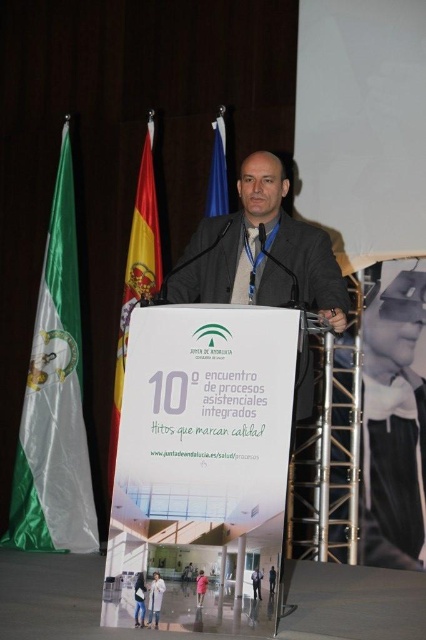
Question: Is red fabric flag at upper left in front of blue fabric flag at upper center?

Choices:
 (A) yes
 (B) no

Answer: (B)

Question: Does dark gray woolen suit at center appear over blue fabric flag at upper center?

Choices:
 (A) no
 (B) yes

Answer: (A)

Question: Which object appears farthest from the camera in this image?

Choices:
 (A) dark gray woolen suit at center
 (B) matte black suit at center
 (C) blue fabric flag at upper center

Answer: (C)

Question: Is dark gray woolen suit at center above red fabric flag at upper left?

Choices:
 (A) no
 (B) yes

Answer: (B)

Question: Which of the following is the farthest from the observer?

Choices:
 (A) matte black suit at center
 (B) dark gray suit at center
 (C) dark gray woolen suit at center
 (D) green satin flag at left

Answer: (D)

Question: Which of the following is the closest to the observer?

Choices:
 (A) red fabric flag at upper left
 (B) dark gray suit at center

Answer: (B)